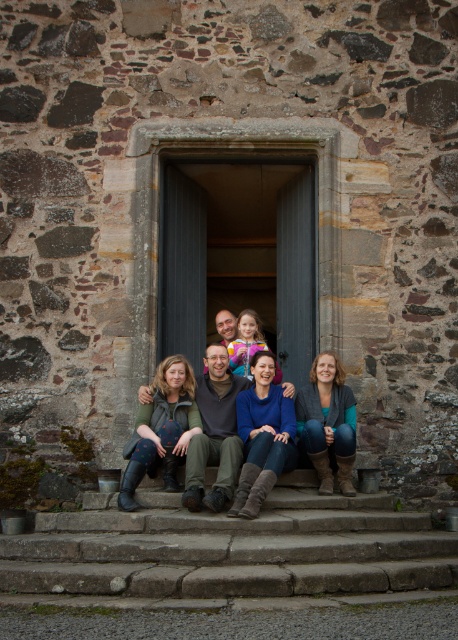
You are standing at the base of the stone steps leading to the doorway in the image. There are two points marked on the steps. The first point is at coordinates point (x=210, y=552) and the second is at point (x=150, y=401). If you want to reach the point that is closer to the doorway, which coordinate should you walk towards?

Point (x=210, y=552) is in front of point (x=150, y=401), so walking towards point (x=210, y=552) will get you closer to the doorway.

You are standing at the point marked by the coordinates point (225,550). Looking at the scene, what object are you standing on?

The point (225,550) is on the stone steps at center, so you are standing on the stone steps at center.

You are standing on the stone steps at center and want to reach the blue denim jeans at center. Which direction should you move?

The stone steps at center is located below blue denim jeans at center, so you should move upward to reach the blue denim jeans at center.